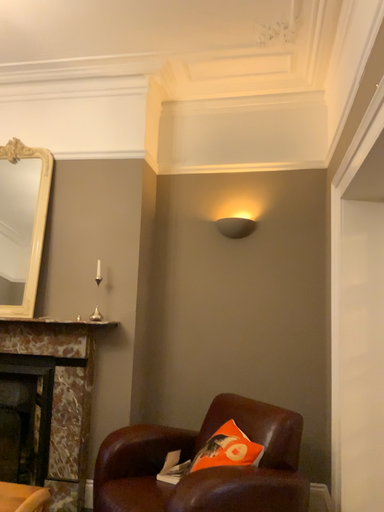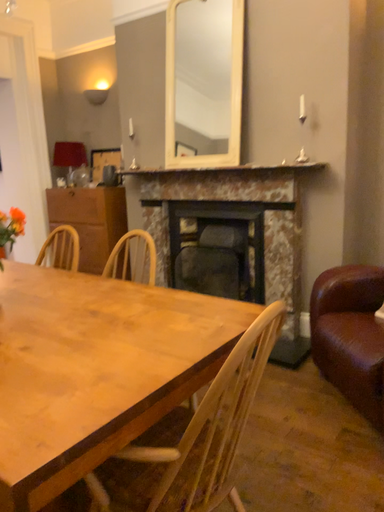
Question: How did the camera likely rotate when shooting the video?

Choices:
 (A) rotated upward
 (B) rotated downward

Answer: (B)